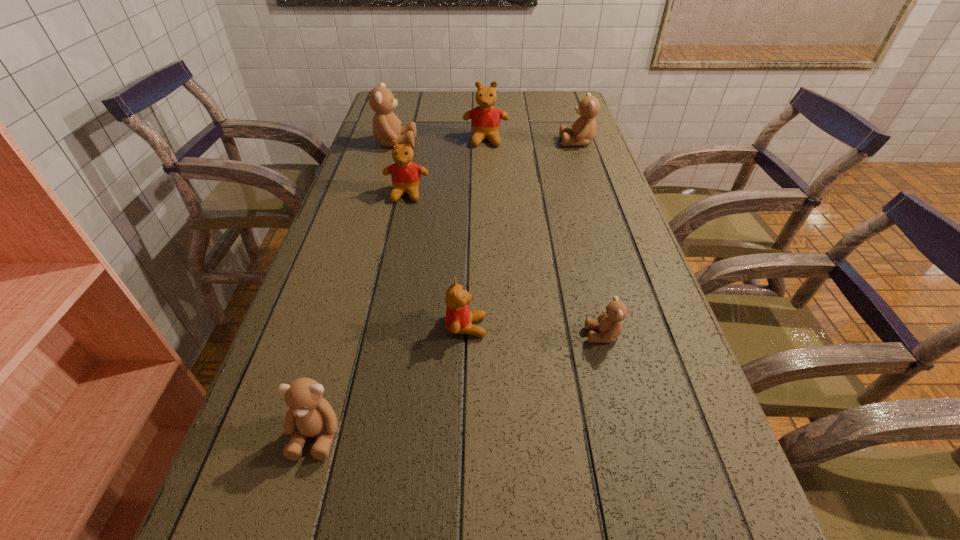
Where is `red teddy bear that is the third closest to the second biggest brown teddy bear`? red teddy bear that is the third closest to the second biggest brown teddy bear is located at coordinates (459, 319).

Where is `free space that satisfies the following two spatial constraints: 1. on the front-facing side of the biggest red teddy bear; 2. on the front-facing side of the biggest brown teddy bear`? free space that satisfies the following two spatial constraints: 1. on the front-facing side of the biggest red teddy bear; 2. on the front-facing side of the biggest brown teddy bear is located at coordinates (486, 143).

Locate an element on the screen. Image resolution: width=960 pixels, height=540 pixels. free region that satisfies the following two spatial constraints: 1. on the front-facing side of the smallest red teddy bear; 2. on the front-facing side of the second smallest brown teddy bear is located at coordinates (463, 435).